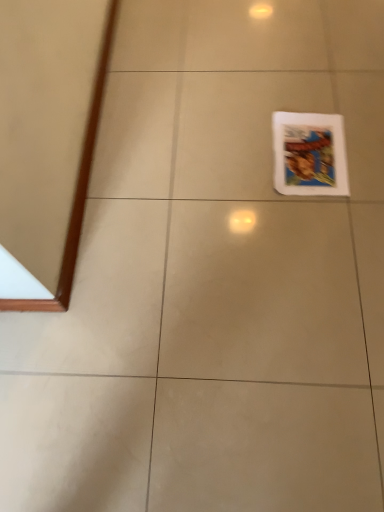
The width and height of the screenshot is (384, 512). Identify the location of free space above white matte picture frame at lower right (from a real-world perspective). (315, 139).